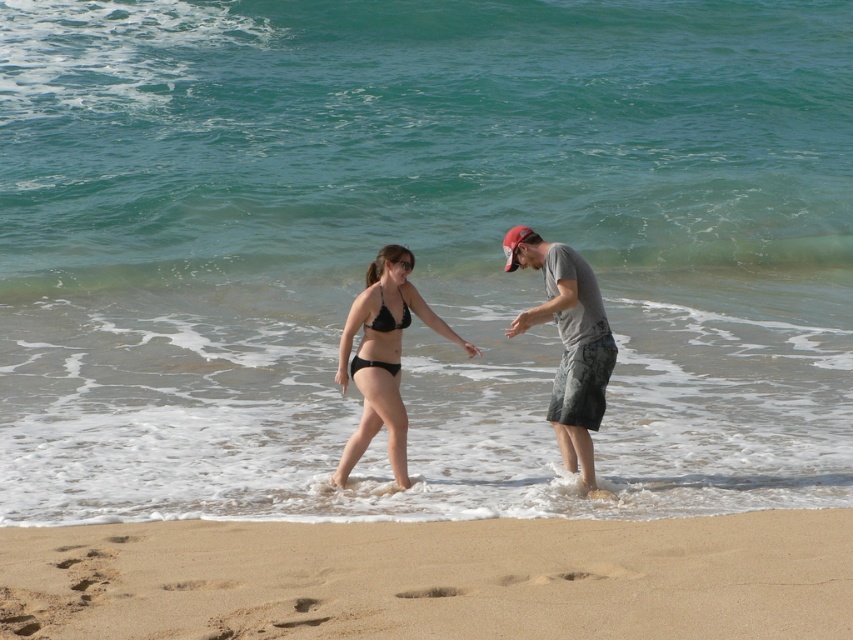
Question: Among these points, which one is nearest to the camera?

Choices:
 (A) (77, 528)
 (B) (572, 465)

Answer: (A)

Question: Which of these objects is positioned farthest from the matte black bikini at center?

Choices:
 (A) black matte bikini at center
 (B) red fabric baseball cap at upper right

Answer: (B)

Question: In this image, where is matte black bikini at center located relative to black matte bikini at center?

Choices:
 (A) right
 (B) left

Answer: (A)

Question: Is fine-grained golden sand at lower center closer to the viewer compared to gray cotton t-shirt at center?

Choices:
 (A) yes
 (B) no

Answer: (A)

Question: Which point is closer to the camera?

Choices:
 (A) (386, 262)
 (B) (409, 296)

Answer: (A)

Question: Is matte black bikini at center above gray cotton t-shirt at center?

Choices:
 (A) no
 (B) yes

Answer: (A)